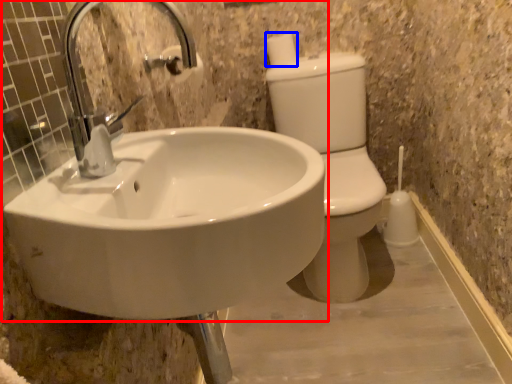
Question: Which object appears closest to the camera in this image, sink (highlighted by a red box) or toilet paper (highlighted by a blue box)?

Choices:
 (A) sink
 (B) toilet paper

Answer: (A)